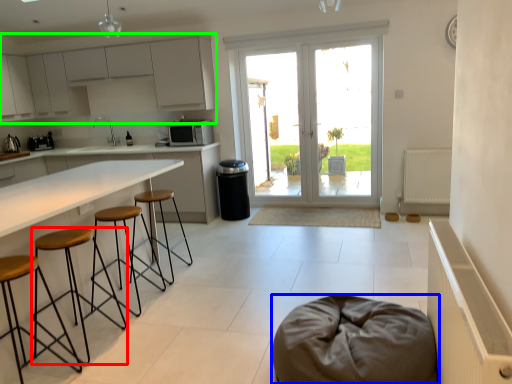
Question: Which object is positioned farthest from stool (highlighted by a red box)? Select from furniture (highlighted by a blue box) and cabinetry (highlighted by a green box).

Choices:
 (A) furniture
 (B) cabinetry

Answer: (B)